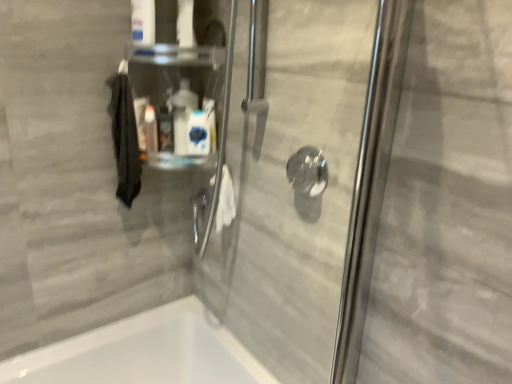
Question: Considering the positions of black matte hand towel at left and transparent glass shower handle at center in the image, is black matte hand towel at left wider or thinner than transparent glass shower handle at center?

Choices:
 (A) thin
 (B) wide

Answer: (B)

Question: From a real-world perspective, is black matte hand towel at left positioned above or below transparent glass shower handle at center?

Choices:
 (A) above
 (B) below

Answer: (B)

Question: Estimate the real-world distances between objects in this image. Which object is farther from the transparent glass shower handle at center?

Choices:
 (A) black matte hand towel at left
 (B) white glossy bottle at upper center, which ranks as the first cleaning product in left-to-right order
 (C) clear plastic container at upper center
 (D) white glossy bottle at center, which is the second cleaning product from left to right

Answer: (A)

Question: Which object is the farthest from the black matte hand towel at left?

Choices:
 (A) white glossy bottle at upper center, which ranks as the first cleaning product in left-to-right order
 (B) white glossy bottle at center, which is the second cleaning product from left to right
 (C) clear plastic container at upper center
 (D) transparent glass shower handle at center

Answer: (D)